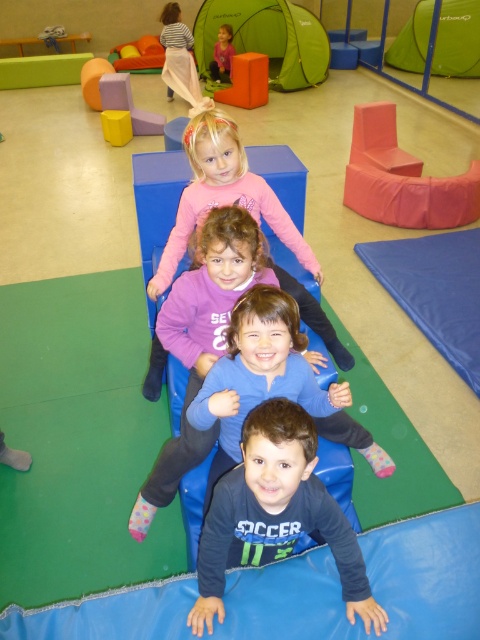
Where is `blue cotton shirt at center`? The width and height of the screenshot is (480, 640). blue cotton shirt at center is located at coordinates 201,339.

Between blue cotton shirt at center and pink fleece sweater at upper center, which one has less height?

pink fleece sweater at upper center is shorter.

Which is in front, point (192, 449) or point (222, 65)?

Point (192, 449) is more forward.

Locate an element on the screen. This screenshot has height=640, width=480. blue cotton shirt at center is located at coordinates (201, 339).

Does pink fleece sweater at center have a smaller size compared to pink fleece sweater at upper center?

Actually, pink fleece sweater at center might be larger than pink fleece sweater at upper center.

Does pink fleece sweater at center appear under pink fleece sweater at upper center?

Yes, pink fleece sweater at center is below pink fleece sweater at upper center.

What are the coordinates of `pink fleece sweater at center` in the screenshot? It's located at (223, 195).

Which is below, dark blue jersey at center or pink fleece sweater at upper center?

dark blue jersey at center is below.

Is dark blue jersey at center bigger than pink fleece sweater at upper center?

No.

You are a GUI agent. You are given a task and a screenshot of the screen. Output one action in this format:
    pyautogui.click(x=<x>, y=<y>)
    Task: Click on the dark blue jersey at center
    This screenshot has width=480, height=640.
    Given the screenshot: What is the action you would take?
    pyautogui.click(x=276, y=513)